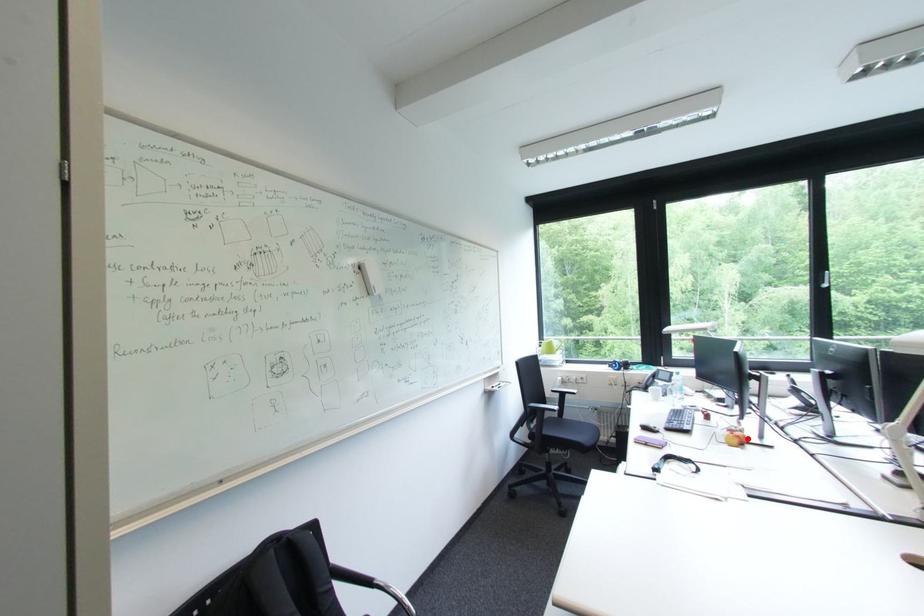
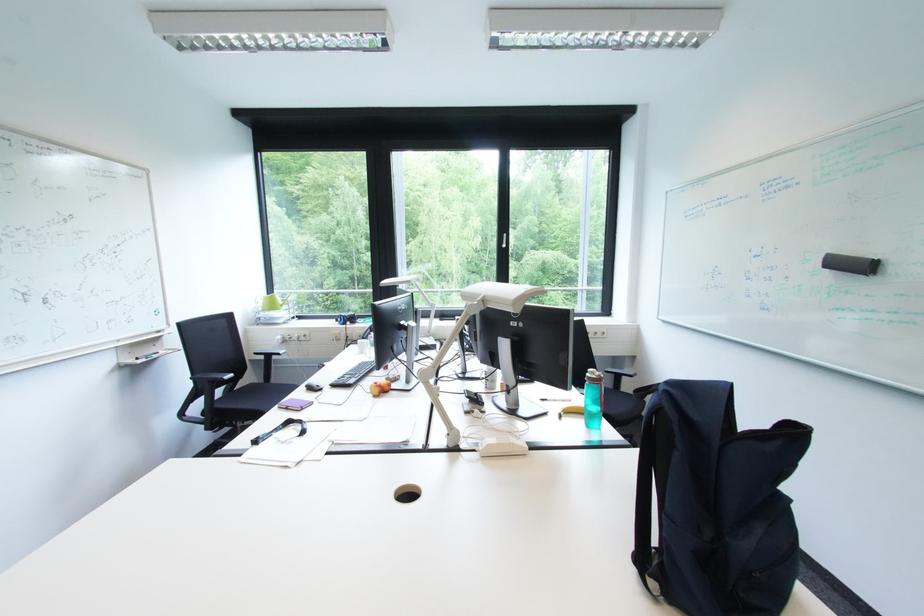
Locate, in the second image, the point that corresponds to the highlighted location in the first image.

(390, 387)